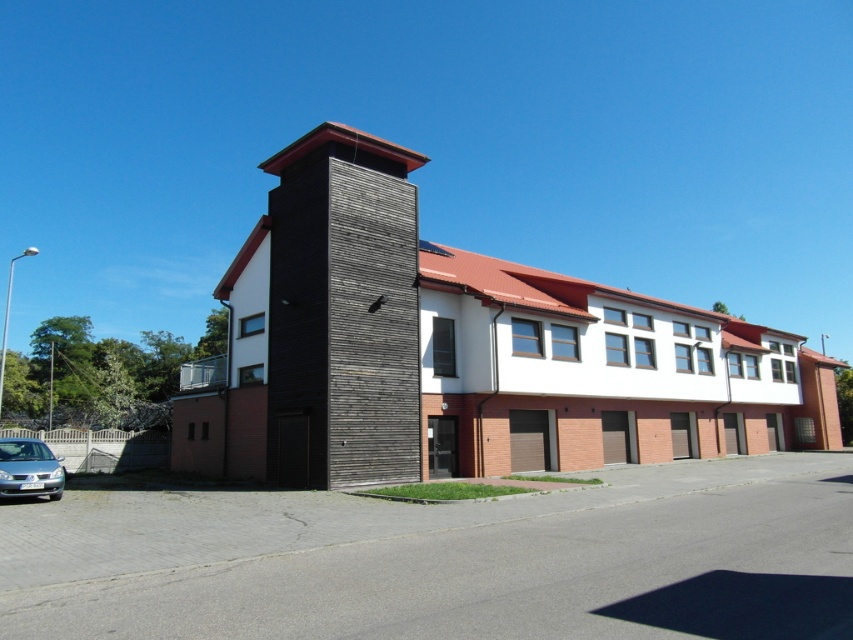
Which is behind, point (410, 476) or point (22, 449)?

The point (410, 476) is more distant.

Who is more forward, (x=416, y=260) or (x=16, y=483)?

Point (x=16, y=483) is more forward.

Is point (397, 465) positioned behind point (22, 458)?

Yes, it is.

This screenshot has height=640, width=853. In order to click on dark brown wood at center in this screenshot , I will do `click(341, 310)`.